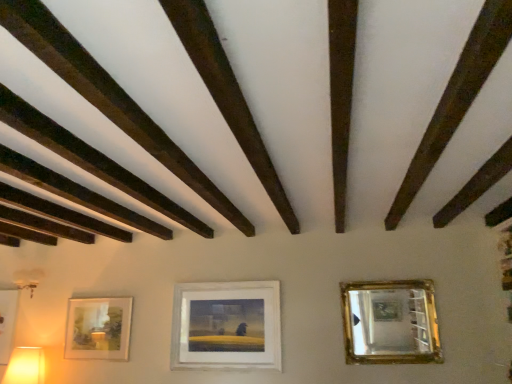
Question: Does matte white picture frame at lower left, acting as the third picture frame starting from the right, appear on the left side of matte yellow plastic table lamp at lower left?

Choices:
 (A) no
 (B) yes

Answer: (B)

Question: From the image's perspective, is matte white picture frame at lower left, acting as the third picture frame starting from the right, below matte yellow plastic table lamp at lower left?

Choices:
 (A) yes
 (B) no

Answer: (B)

Question: Is matte white picture frame at lower left, acting as the third picture frame starting from the right, not close to matte yellow plastic table lamp at lower left?

Choices:
 (A) yes
 (B) no

Answer: (B)

Question: Can you confirm if matte white picture frame at lower left, acting as the third picture frame starting from the right, is taller than matte yellow plastic table lamp at lower left?

Choices:
 (A) yes
 (B) no

Answer: (A)

Question: Is matte white picture frame at lower left, acting as the third picture frame starting from the right, turned away from matte yellow plastic table lamp at lower left?

Choices:
 (A) yes
 (B) no

Answer: (B)

Question: From the image's perspective, is matte white picture frame at lower left, placed as the 1th picture frame when sorted from left to right, over matte yellow plastic table lamp at lower left?

Choices:
 (A) no
 (B) yes

Answer: (B)

Question: Can you confirm if dark brown wood at upper left is thinner than gold-framed mirror at upper right?

Choices:
 (A) no
 (B) yes

Answer: (A)

Question: From a real-world perspective, is dark brown wood at upper left positioned over gold-framed mirror at upper right based on gravity?

Choices:
 (A) no
 (B) yes

Answer: (B)

Question: Is dark brown wood at upper left not near gold-framed mirror at upper right?

Choices:
 (A) yes
 (B) no

Answer: (A)

Question: Is the position of dark brown wood at upper left less distant than that of gold-framed mirror at upper right?

Choices:
 (A) yes
 (B) no

Answer: (A)

Question: Does dark brown wood at upper left appear on the right side of gold-framed mirror at upper right?

Choices:
 (A) yes
 (B) no

Answer: (B)

Question: From a real-world perspective, is dark brown wood at upper left physically below gold-framed mirror at upper right?

Choices:
 (A) yes
 (B) no

Answer: (B)

Question: Can you confirm if matte white picture frame at lower left, acting as the third picture frame starting from the right, is bigger than dark brown wood at upper left?

Choices:
 (A) yes
 (B) no

Answer: (B)